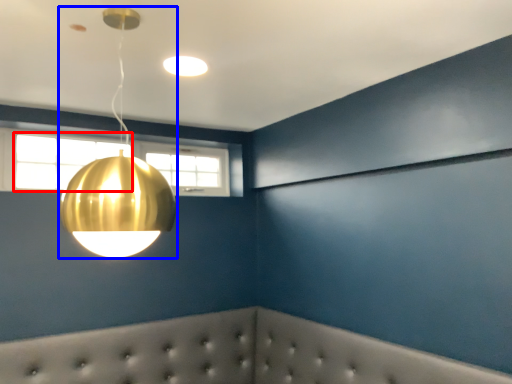
Question: Among these objects, which one is farthest to the camera, window (highlighted by a red box) or lamp (highlighted by a blue box)?

Choices:
 (A) window
 (B) lamp

Answer: (A)